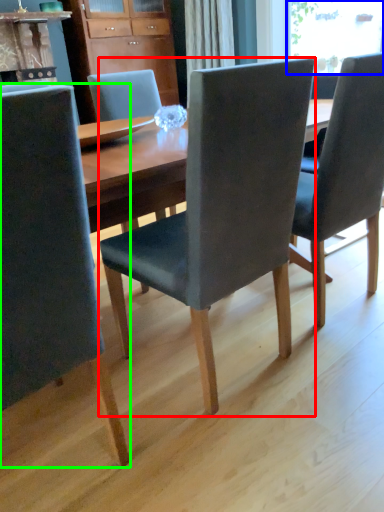
Question: Which is farther away from chair (highlighted by a red box)? window screen (highlighted by a blue box) or chair (highlighted by a green box)?

Choices:
 (A) window screen
 (B) chair

Answer: (A)